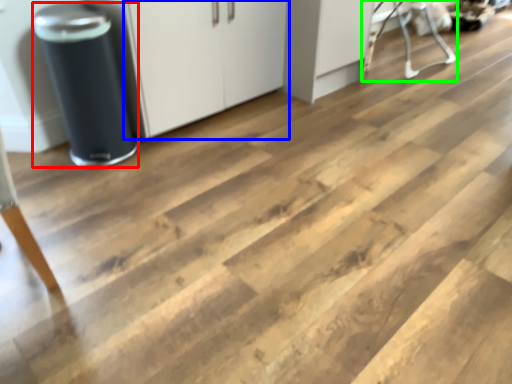
Question: Estimate the real-world distances between objects in this image. Which object is farther from appliance (highlighted by a red box), cabinetry (highlighted by a blue box) or furniture (highlighted by a green box)?

Choices:
 (A) cabinetry
 (B) furniture

Answer: (B)